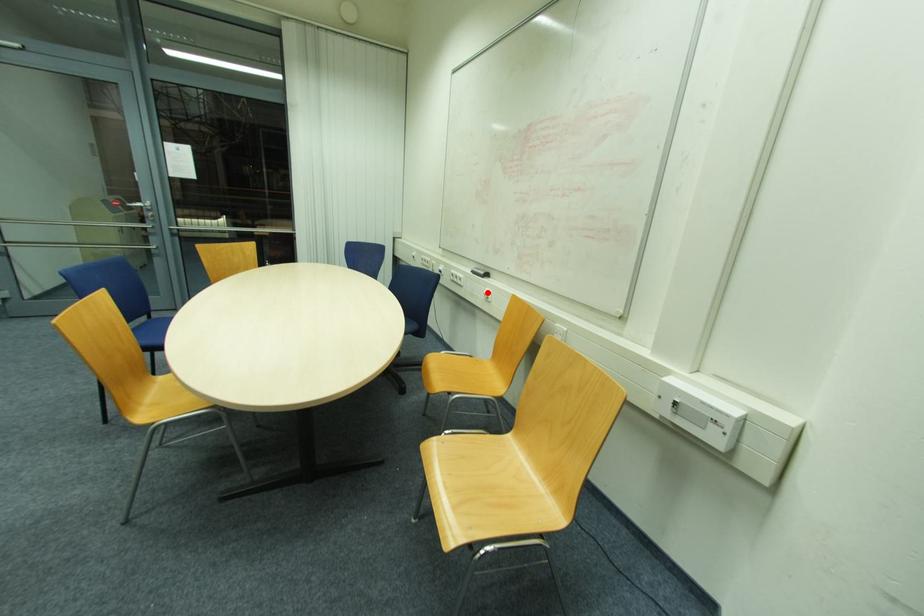
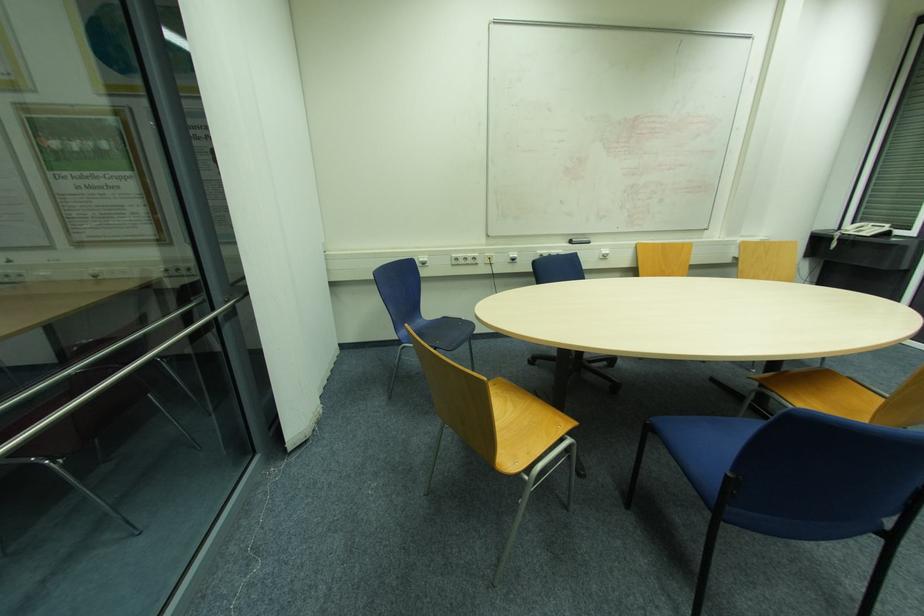
In the second image, find the point that corresponds to the highlighted location in the first image.

(604, 253)